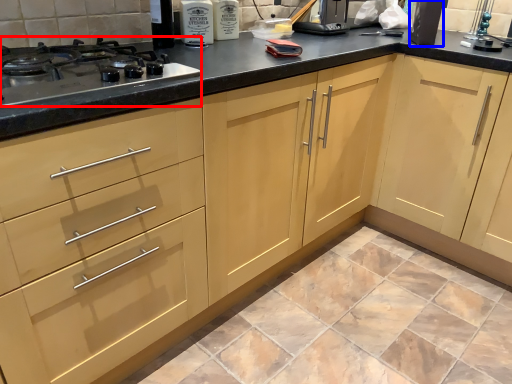
Question: Among these objects, which one is nearest to the camera, gas stove (highlighted by a red box) or appliance (highlighted by a blue box)?

Choices:
 (A) gas stove
 (B) appliance

Answer: (A)